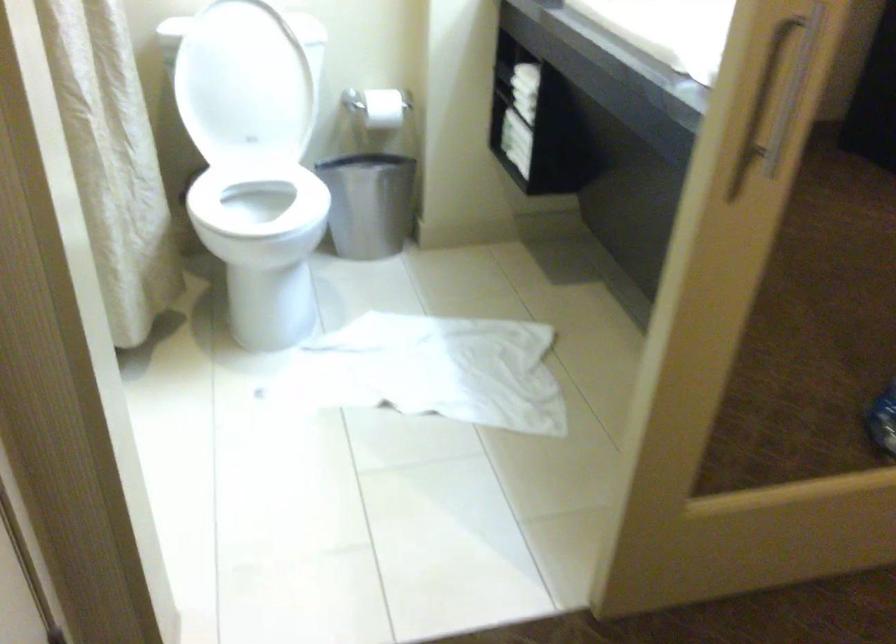
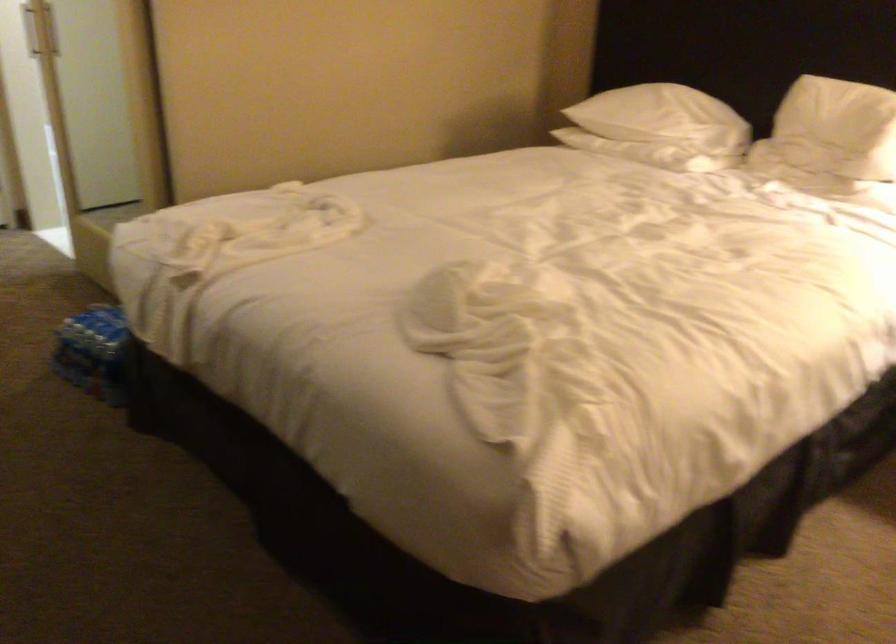
Question: I am providing you with two images of the same scene from different viewpoints. Which of the following objects are not visible in image2?

Choices:
 (A) white toilet seat
 (B) white pillow
 (C) E.T. plush toy
 (D) door handle

Answer: (A)